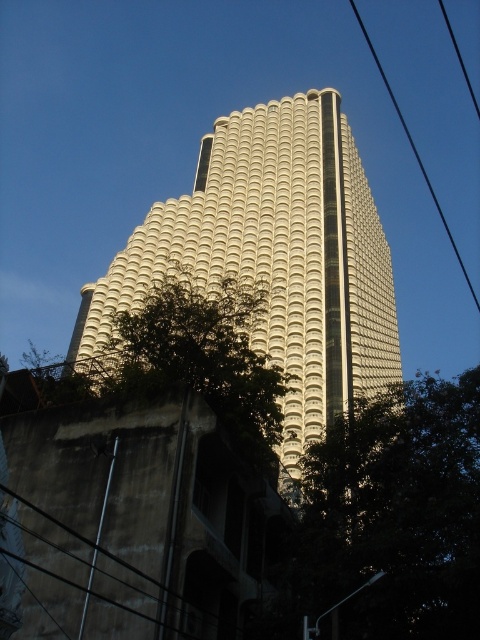
You are a city planner assessing the space between two green leafy trees in the image. The trees are the green leafy tree at lower right and the green leafy tree at center. Which of these trees takes up more area in the image?

The green leafy tree at center occupies more space than the green leafy tree at lower right, so the tree at center takes up more area.

You are standing in front of the modern building and want to take a photo that includes both the green leafy tree at center and the black wire at upper right. Which object will appear taller in the photo?

The black wire at upper right appears taller in the photo because the green leafy tree at center has a lesser height compared to it.